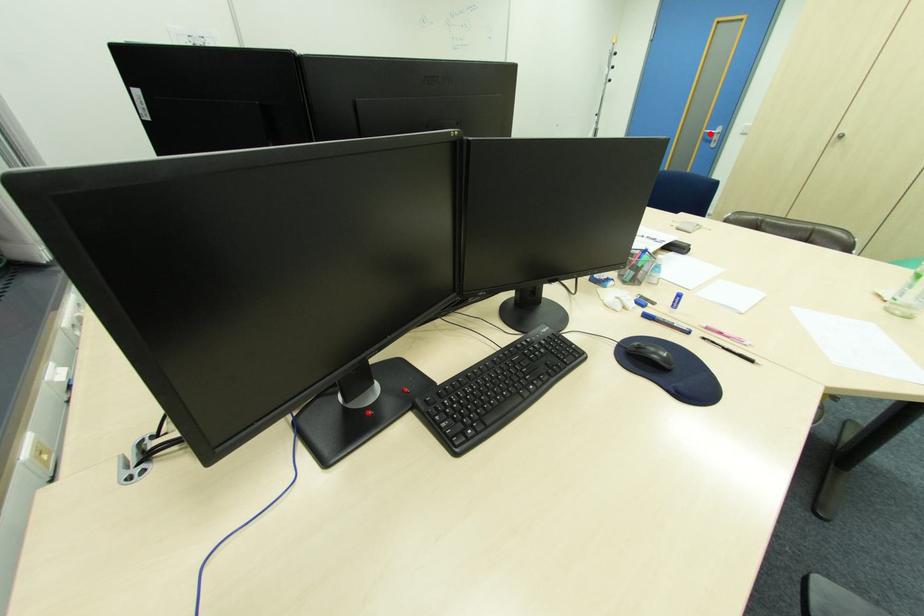
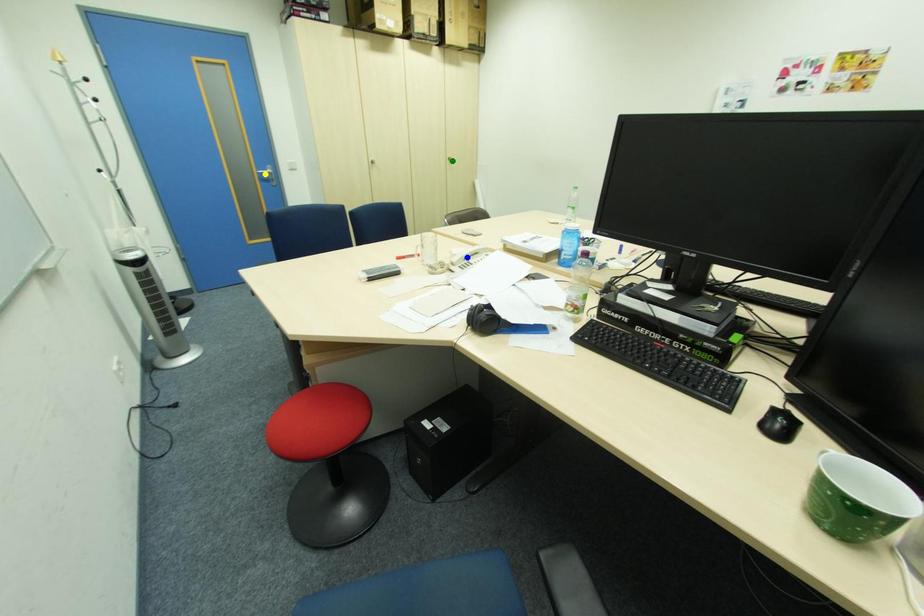
Question: I am providing you with two images of the same scene from different viewpoints. A red point is marked on the first image. You are given multiple points on the second image. Which point in image 2 is actually the same real-world point as the red point in image 1?

Choices:
 (A) blue point
 (B) yellow point
 (C) green point

Answer: (B)